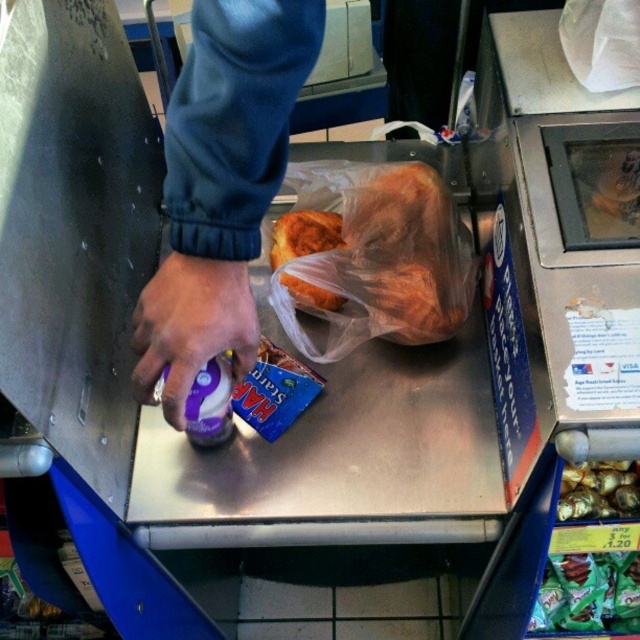
Looking at this image, does green matte candy at lower right come behind shiny gold foil at center?

Yes, green matte candy at lower right is further from the viewer.

Describe the element at coordinates (588, 593) in the screenshot. I see `green matte candy at lower right` at that location.

This screenshot has height=640, width=640. Identify the location of green matte candy at lower right. (588, 593).

Does golden brown bread at center have a larger size compared to green matte candy at lower right?

Indeed, golden brown bread at center has a larger size compared to green matte candy at lower right.

Does golden brown bread at center have a lesser height compared to green matte candy at lower right?

Incorrect, golden brown bread at center's height does not fall short of green matte candy at lower right's.

Identify the location of golden brown bread at center. This screenshot has width=640, height=640. (376, 257).

Based on the photo, does golden brown bread at center come in front of shiny gold foil at center?

No.

Between golden brown bread at center and shiny gold foil at center, which one is positioned higher?

golden brown bread at center is above.

Is point (442, 211) closer to camera compared to point (636, 506)?

No, (442, 211) is behind (636, 506).

Image resolution: width=640 pixels, height=640 pixels. I want to click on golden brown bread at center, so click(x=376, y=257).